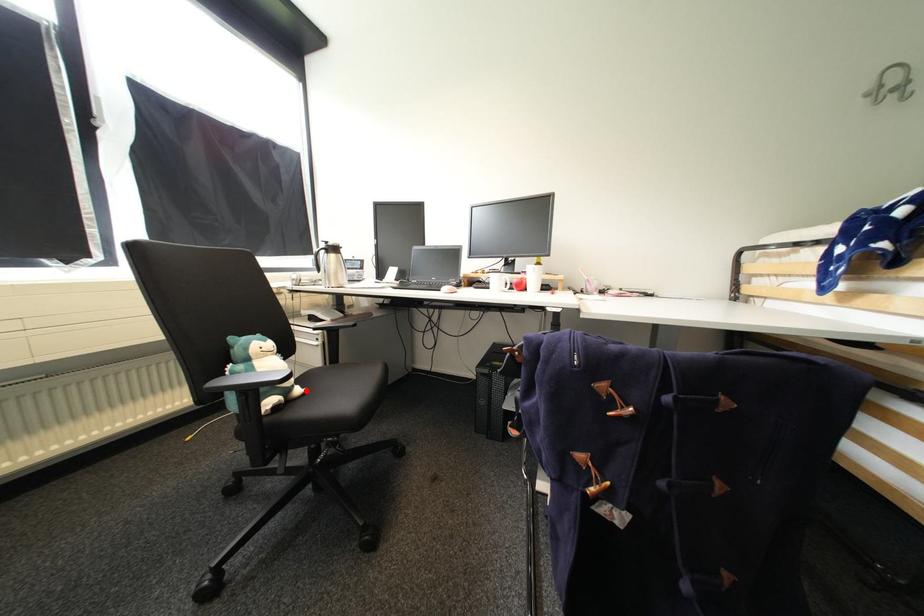
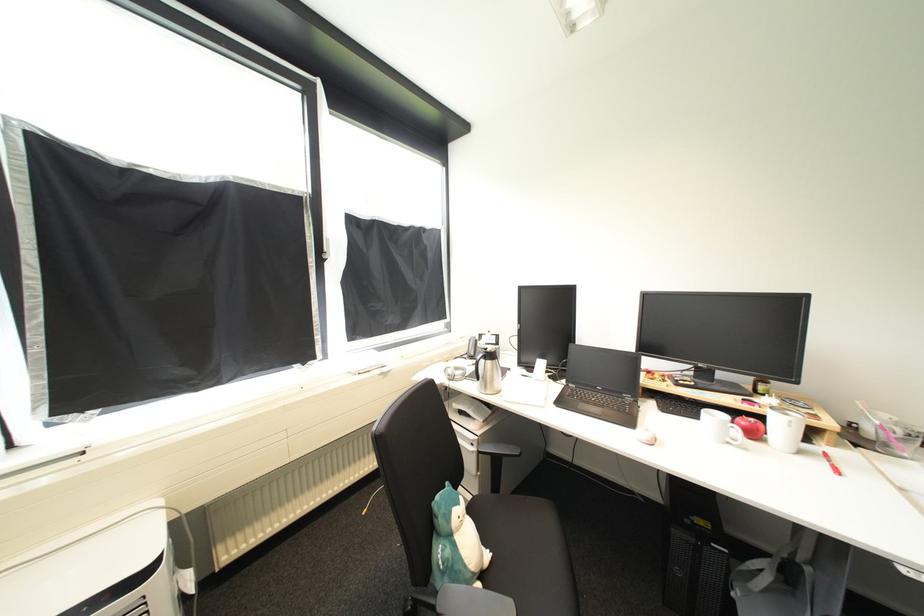
The point at the highlighted location is marked in the first image. Where is the corresponding point in the second image?

(493, 557)